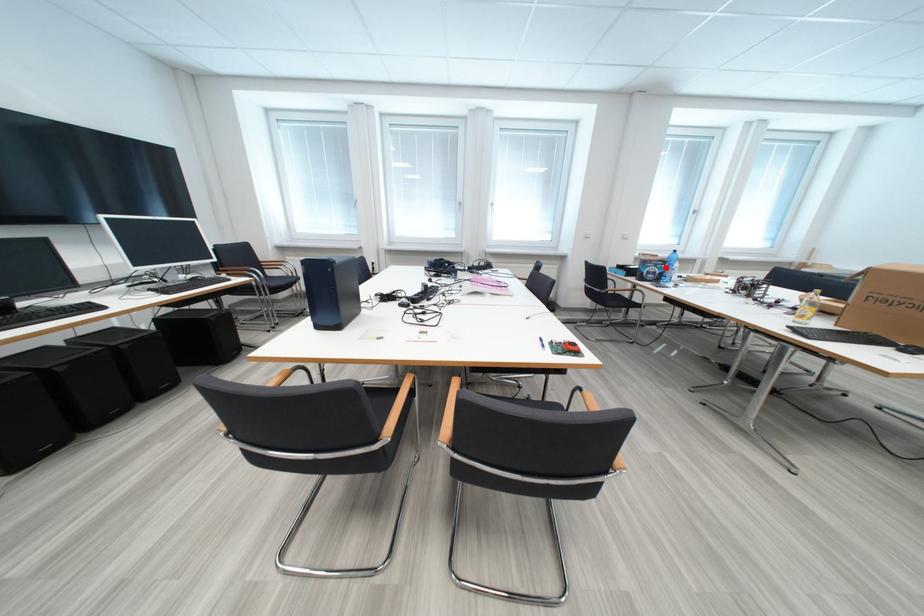
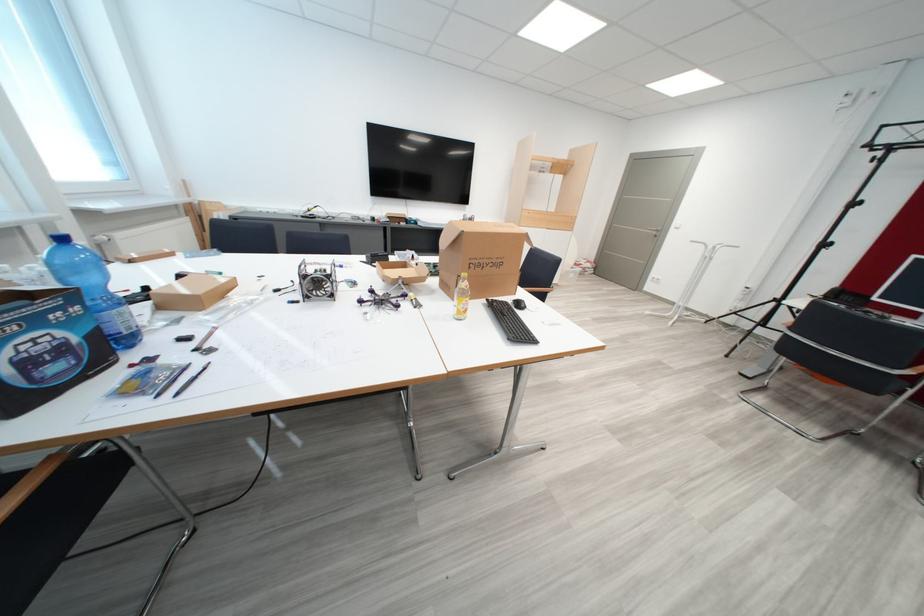
Question: A red point is marked in image1. In image2, is the corresponding 3D point closer to the camera or farther? Reply with the corresponding letter.

Choices:
 (A) The corresponding 3D point is closer.
 (B) The corresponding 3D point is farther.

Answer: (B)